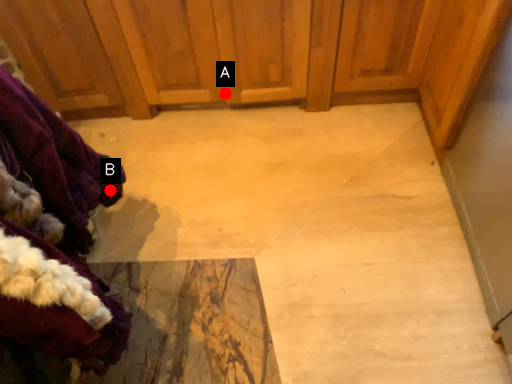
Question: Two points are circled on the image, labeled by A and B beside each circle. Which point is closer to the camera?

Choices:
 (A) A is closer
 (B) B is closer

Answer: (B)